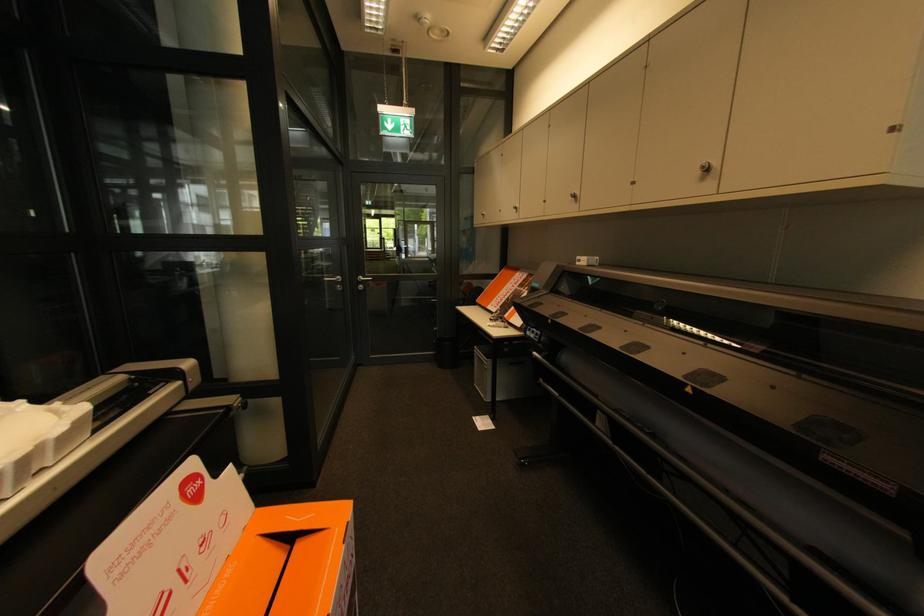
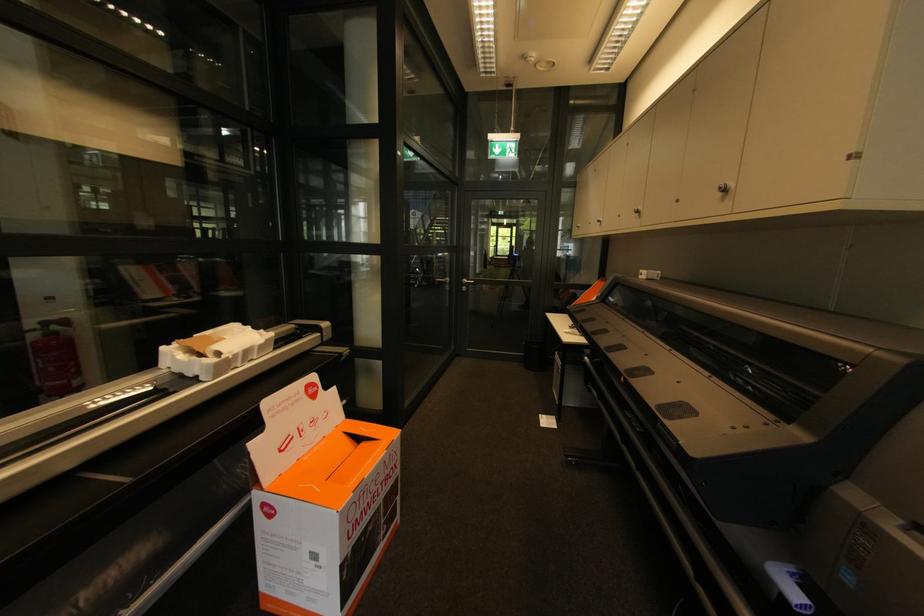
Question: The camera is either moving clockwise (left) or counter-clockwise (right) around the object. The first image is from the beginning of the video and the second image is from the end. Is the camera moving left or right when shooting the video?

Choices:
 (A) Left
 (B) Right

Answer: (B)